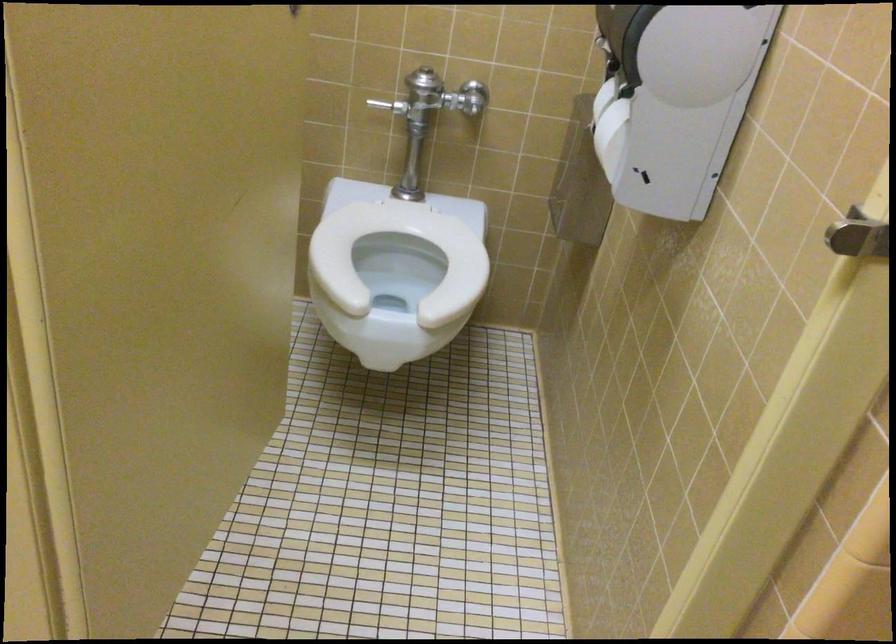
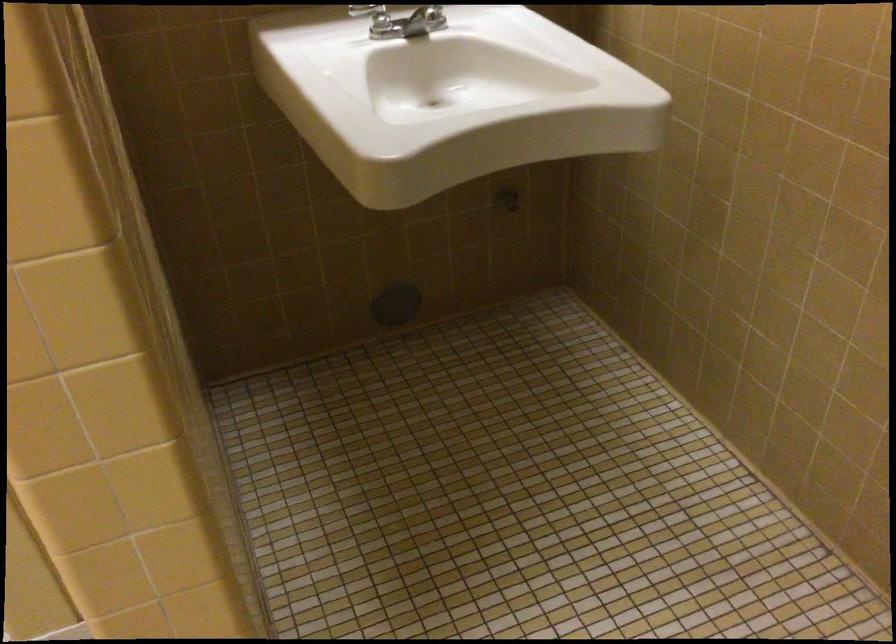
Question: The images are taken continuously from a first-person perspective. In which direction are you moving?

Choices:
 (A) Left
 (B) Right
 (C) Forward
 (D) Backward

Answer: (B)